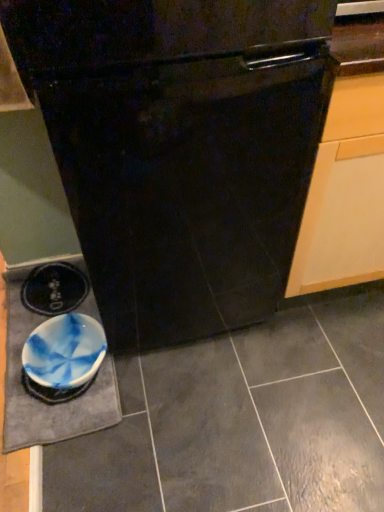
Question: Considering the positions of blue marbled bowl at lower left and black glossy oven at center in the image, is blue marbled bowl at lower left taller or shorter than black glossy oven at center?

Choices:
 (A) short
 (B) tall

Answer: (A)

Question: Is blue marbled bowl at lower left in front of or behind black glossy oven at center in the image?

Choices:
 (A) behind
 (B) front

Answer: (A)

Question: Considering the real-world distances, which object is closest to the blue marbled bowl at lower left?

Choices:
 (A) black glossy oven at center
 (B) blue marbled slate at lower left

Answer: (B)

Question: Considering the real-world distances, which object is farthest from the black glossy oven at center?

Choices:
 (A) blue marbled slate at lower left
 (B) blue marbled bowl at lower left

Answer: (A)